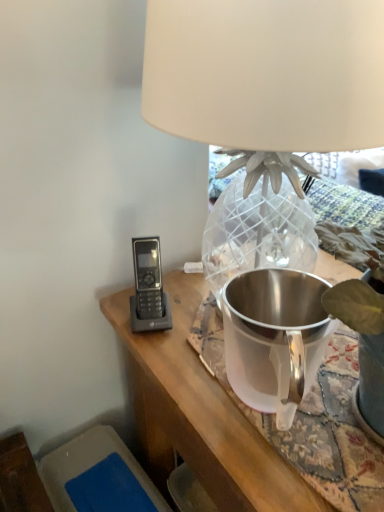
Question: Is matte white lampshade at upper center bigger or smaller than satin silver pitcher at center?

Choices:
 (A) big
 (B) small

Answer: (A)

Question: Is matte white lampshade at upper center spatially inside satin silver pitcher at center, or outside of it?

Choices:
 (A) inside
 (B) outside

Answer: (B)

Question: Is matte white lampshade at upper center taller or shorter than satin silver pitcher at center?

Choices:
 (A) tall
 (B) short

Answer: (A)

Question: From the image's perspective, is satin silver pitcher at center above or below matte white lampshade at upper center?

Choices:
 (A) above
 (B) below

Answer: (B)

Question: Considering the positions of satin silver pitcher at center and matte white lampshade at upper center in the image, is satin silver pitcher at center taller or shorter than matte white lampshade at upper center?

Choices:
 (A) short
 (B) tall

Answer: (A)

Question: Is point (259, 380) closer or farther from the camera than point (316, 83)?

Choices:
 (A) farther
 (B) closer

Answer: (A)

Question: Considering the positions of satin silver pitcher at center and matte white lampshade at upper center in the image, is satin silver pitcher at center wider or thinner than matte white lampshade at upper center?

Choices:
 (A) wide
 (B) thin

Answer: (B)